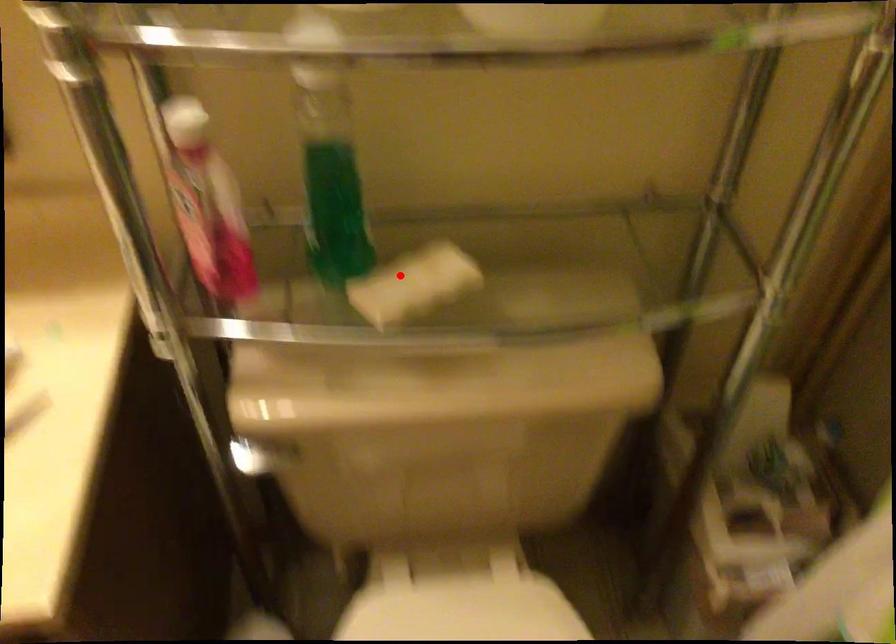
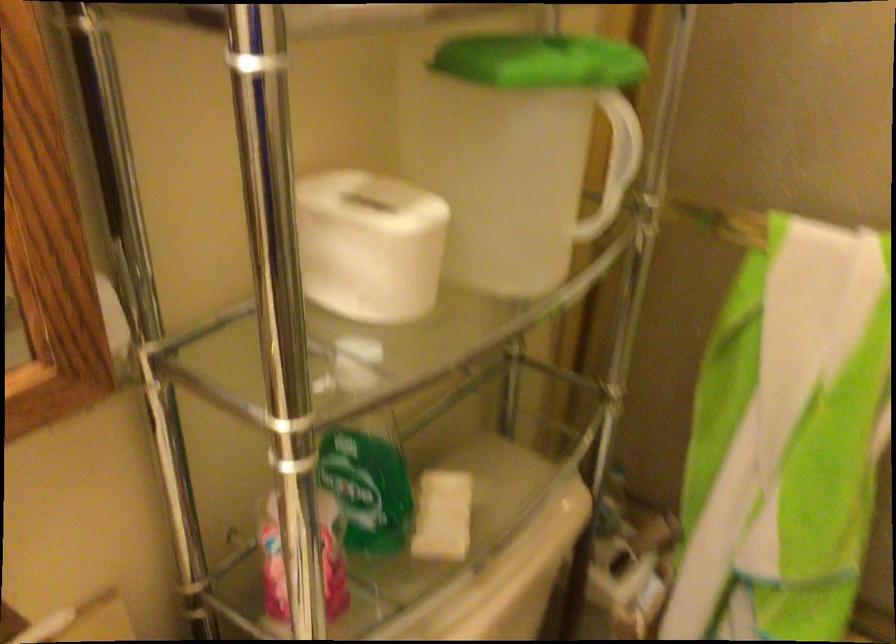
Locate, in the second image, the point that corresponds to the highlighted location in the first image.

(442, 516)